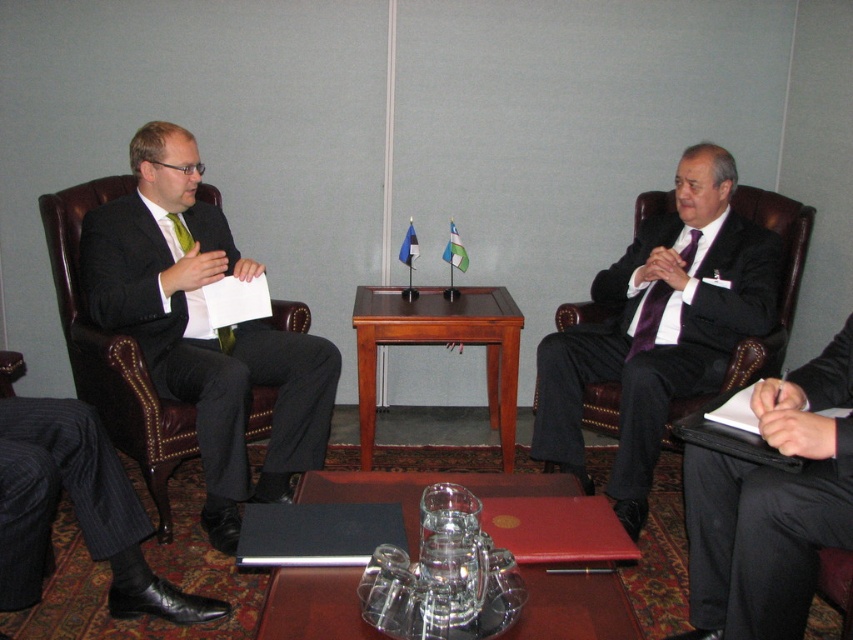
You are a photographer setting up for a professional headshot session in this meeting scene. You need to ensure that the black smooth suit at right and the brown wooden table at center are both visible in the frame. Based on their heights, which object should you position closer to the camera to avoid one blocking the other?

The black smooth suit at right is taller than the brown wooden table at center. To avoid the suit blocking the table, position the brown wooden table at center closer to the camera so it remains visible.